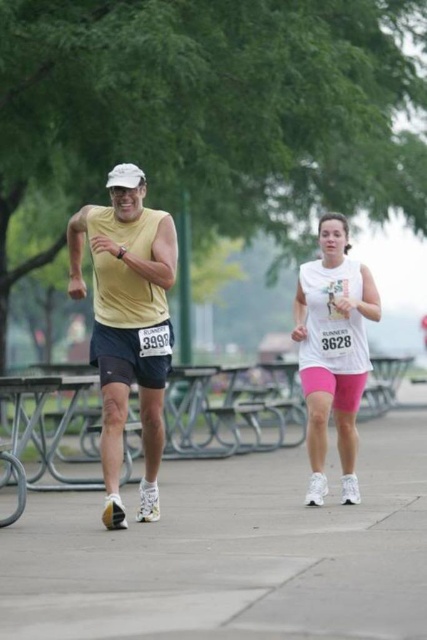
You are a photographer standing at the camera position. You want to take a photo of the man in the yellow shirt. The man is currently at point [219,561]. If you move 5 meters closer to him, will you be able to take a clear photo without any obstructions?

The distance between the camera and point [219,561] is 7.89 meters. If you move 5 meters closer, you will be 2.89 meters away from him. Since there are no obstructions mentioned in the scene description, you can take a clear photo.

You are a photographer standing at the starting line of the race. You want to take a photo of the gray concrete pavement at center and the white matte tank top at center. Which object should you focus on first to ensure both are in clear view?

You should focus on the gray concrete pavement at center first since it is closer to the viewer than the white matte tank top at center, allowing both to be in focus when using depth of field techniques.

You are a photographer standing at the edge of the running path. You want to take a photo of the gray concrete pavement at center and the white matte tank top at center such that both are clearly visible. Given their height relationship, which object should be placed closer to the camera to ensure both are in focus?

The gray concrete pavement at center is lower in height than the white matte tank top at center. To ensure both are in focus, the photographer should position the gray concrete pavement at center closer to the camera since it is shorter, allowing the depth of field to capture both objects effectively.